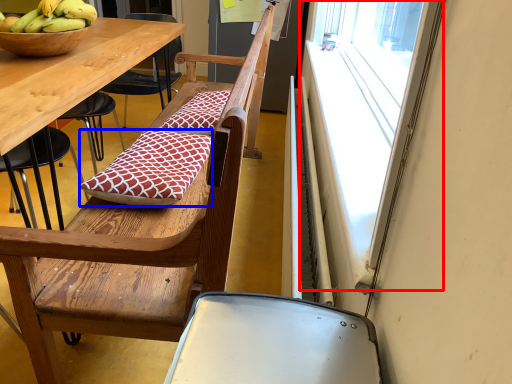
Question: Among these objects, which one is nearest to the camera, window (highlighted by a red box) or pillow (highlighted by a blue box)?

Choices:
 (A) window
 (B) pillow

Answer: (A)